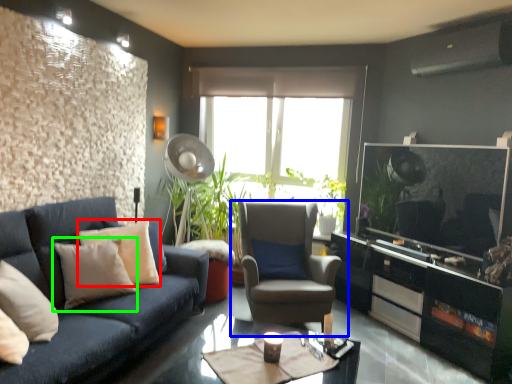
Question: Which object is the farthest from pillow (highlighted by a red box)? Choose among these: chair (highlighted by a blue box) or pillow (highlighted by a green box).

Choices:
 (A) chair
 (B) pillow

Answer: (A)